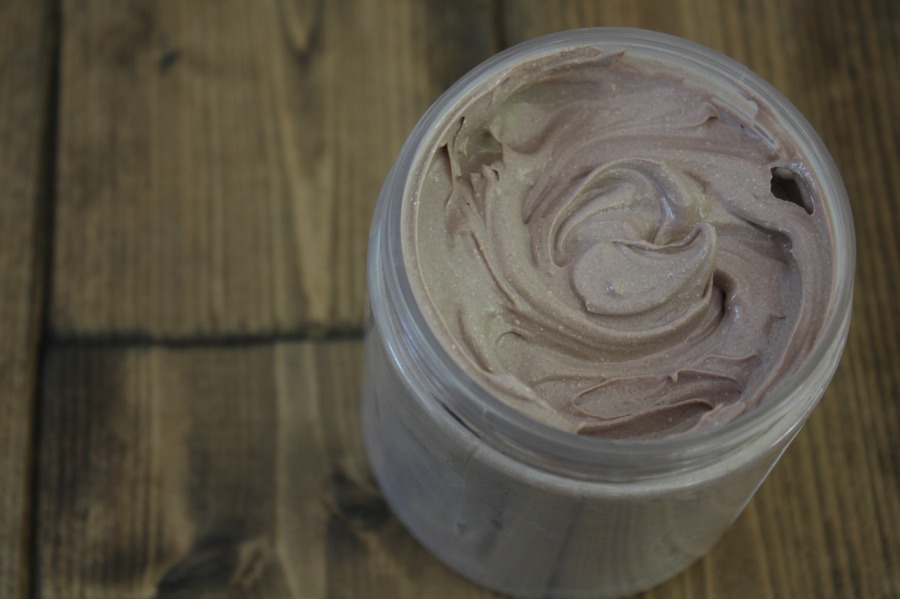
Where is `plastic jar`? plastic jar is located at coordinates (667, 505).